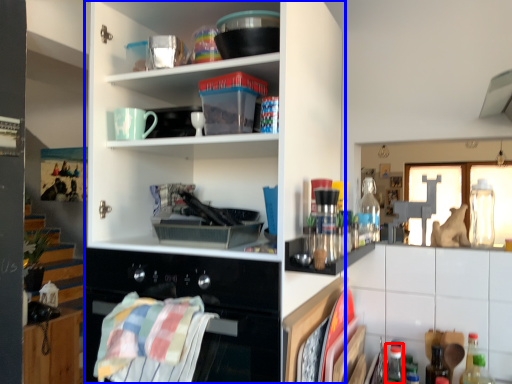
Question: Which object is closer to the camera taking this photo, bottle (highlighted by a red box) or cupboard (highlighted by a blue box)?

Choices:
 (A) bottle
 (B) cupboard

Answer: (B)